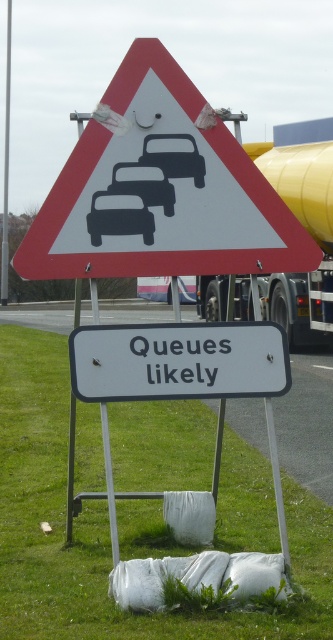
Question: Does matte black car at center have a smaller size compared to black matte car at center?

Choices:
 (A) no
 (B) yes

Answer: (A)

Question: Which point is closer to the camera?

Choices:
 (A) (150, 452)
 (B) (95, 237)

Answer: (B)

Question: Is matte black car at center below black matte car at center?

Choices:
 (A) yes
 (B) no

Answer: (A)

Question: Which object appears farthest from the camera in this image?

Choices:
 (A) green grass at lower center
 (B) yellow rubber trailer truck at upper right
 (C) black matte car at center
 (D) black glossy car at center

Answer: (C)

Question: Does green grass at lower center have a larger size compared to black matte car at center?

Choices:
 (A) no
 (B) yes

Answer: (B)

Question: Which object is farther from the camera taking this photo?

Choices:
 (A) black matte car at center
 (B) green grass at lower center

Answer: (A)